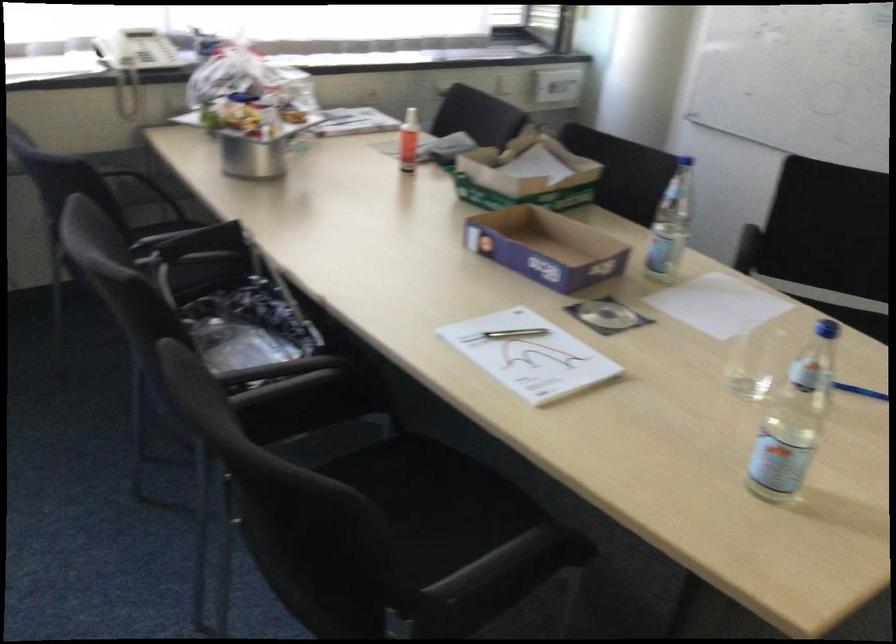
Image resolution: width=896 pixels, height=644 pixels. Find the location of `metal container`. metal container is located at coordinates [254, 134].